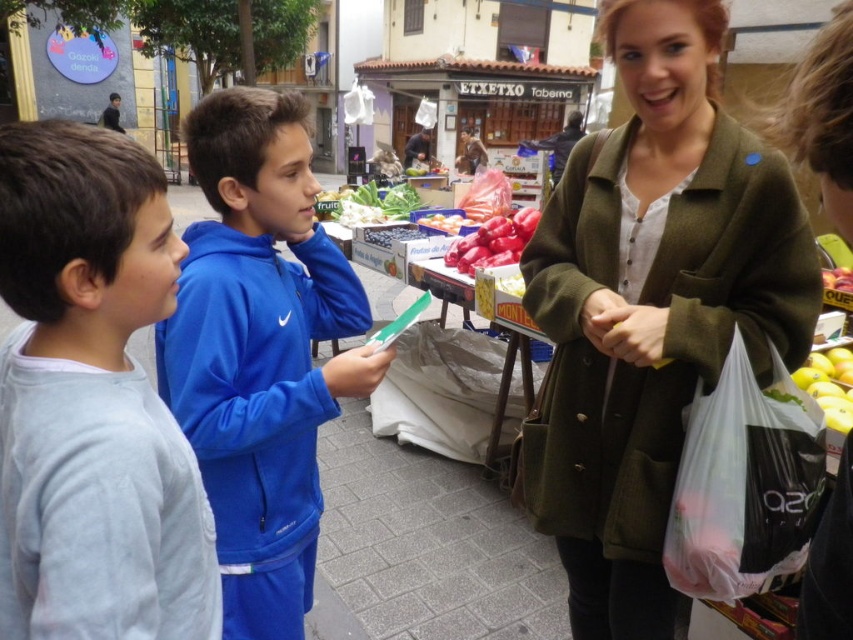
Can you confirm if green woolen coat at center is positioned to the right of blue fleece jacket at center?

Correct, you'll find green woolen coat at center to the right of blue fleece jacket at center.

Based on the photo, is green woolen coat at center closer to camera compared to blue fleece jacket at center?

No, it is not.

At what (x,y) coordinates should I click in order to perform the action: click on green woolen coat at center. Please return your answer as a coordinate pair (x, y). The image size is (853, 640). Looking at the image, I should click on (651, 307).

Between green woolen coat at center and green leafy vegetables at center, which one is positioned lower?

green woolen coat at center is below.

This screenshot has width=853, height=640. What do you see at coordinates (651, 307) in the screenshot?
I see `green woolen coat at center` at bounding box center [651, 307].

Where is `green woolen coat at center`? This screenshot has width=853, height=640. green woolen coat at center is located at coordinates (651, 307).

How much distance is there between red matte tomatoes at center and green leafy vegetables at center?

red matte tomatoes at center is 1.25 meters from green leafy vegetables at center.

Is red matte tomatoes at center above green leafy vegetables at center?

No, red matte tomatoes at center is not above green leafy vegetables at center.

The image size is (853, 640). I want to click on red matte tomatoes at center, so click(x=492, y=241).

Where is `red matte tomatoes at center`? red matte tomatoes at center is located at coordinates (492, 241).